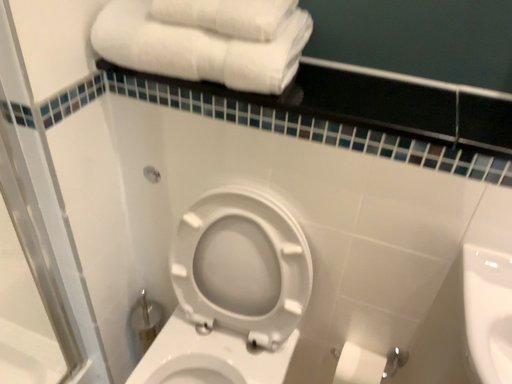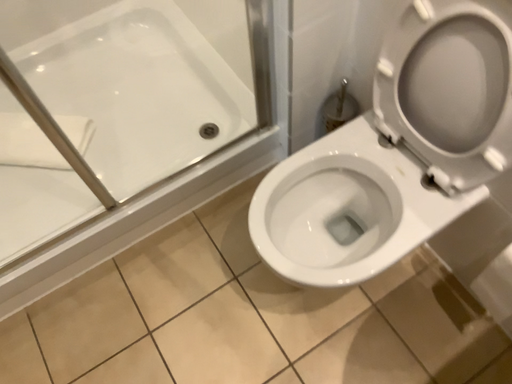
Question: How did the camera likely rotate when shooting the video?

Choices:
 (A) rotated right
 (B) rotated left

Answer: (B)